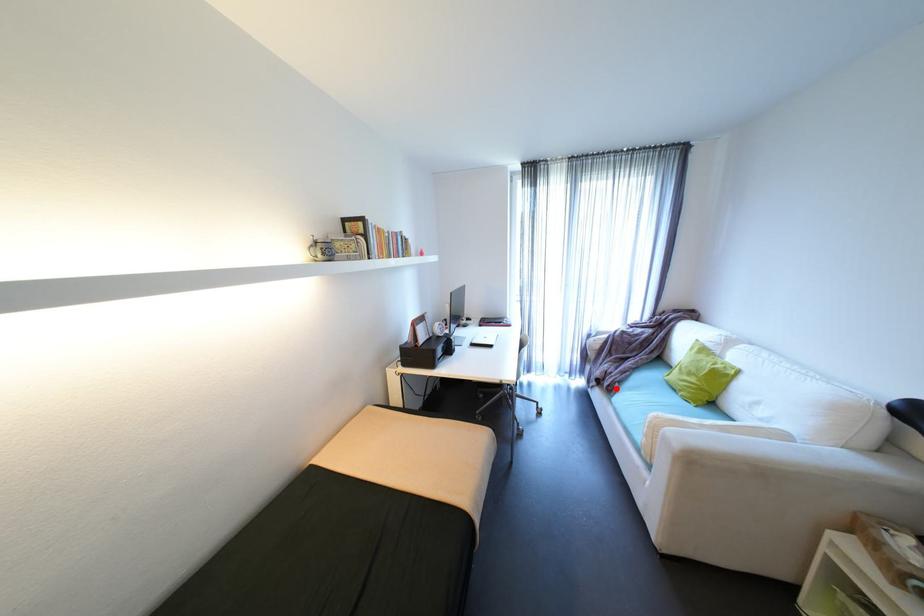
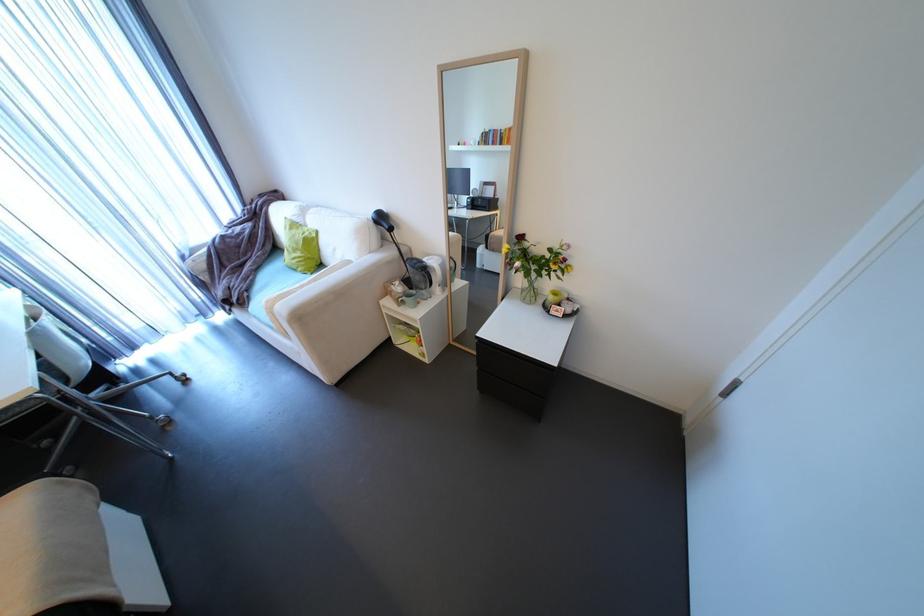
Locate, in the second image, the point that corresponds to the highlighted location in the first image.

(248, 302)